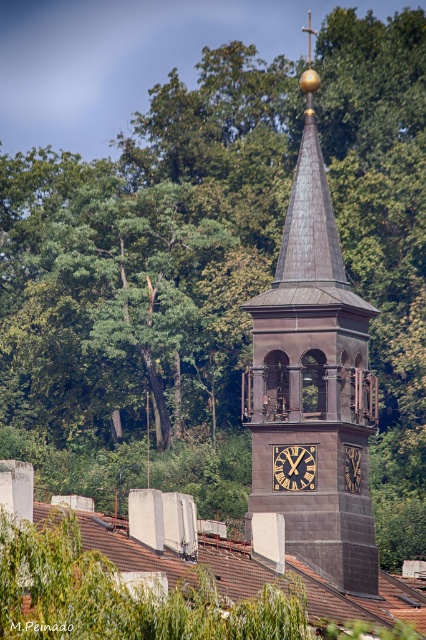
You are standing in a park and see a point marked at coordinates (314, 380). Based on the scene description, what object does this point correspond to?

The point corresponds to the dark gray stone clock tower at center.

You are standing in front of the dark gray stone clock tower at center and the gold metallic clock at center. Which object is taller?

The dark gray stone clock tower at center is much taller than the gold metallic clock at center.